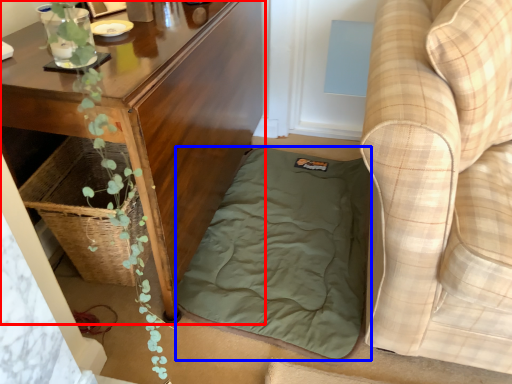
Question: Which of the following is the closest to the observer, table (highlighted by a red box) or mattress (highlighted by a blue box)?

Choices:
 (A) table
 (B) mattress

Answer: (A)